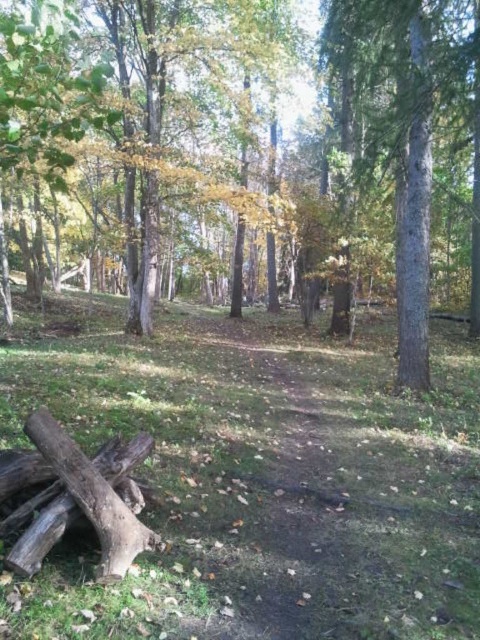
You are a hiker who wants to place a small backpack on the ground near the brown wood tree at center without blocking the view of the brown rough wood at lower left. Where should you place it?

The brown wood tree at center is positioned over brown rough wood at lower left, so placing the backpack to the side or behind the brown wood tree at center would keep the view of the brown rough wood at lower left unobstructed.

Looking at this image, you are standing at the origin point in the forest and want to reach the brown wood tree at center. What are the coordinates you need to move to?

The coordinates of the brown wood tree at center are at point (253, 140), so you need to move to those coordinates to reach it.